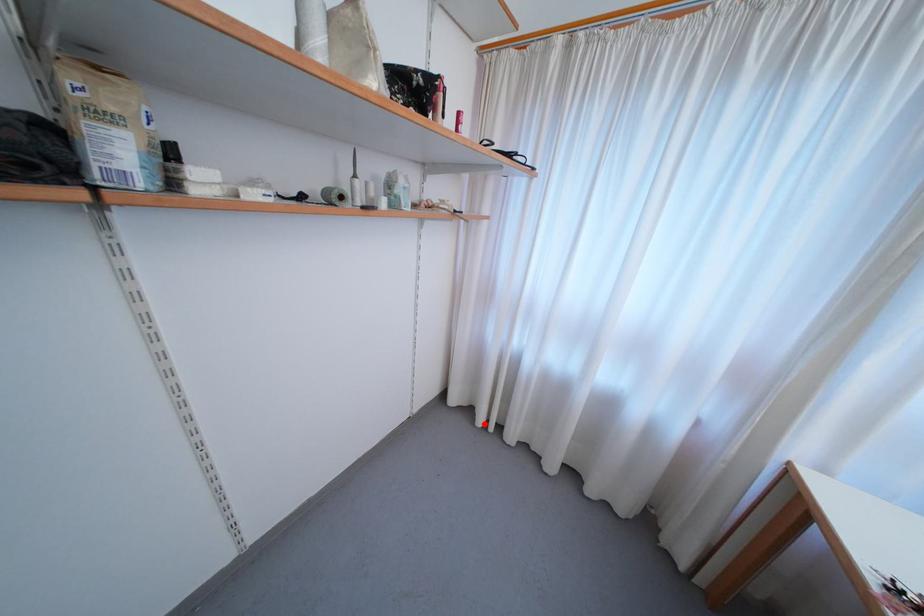
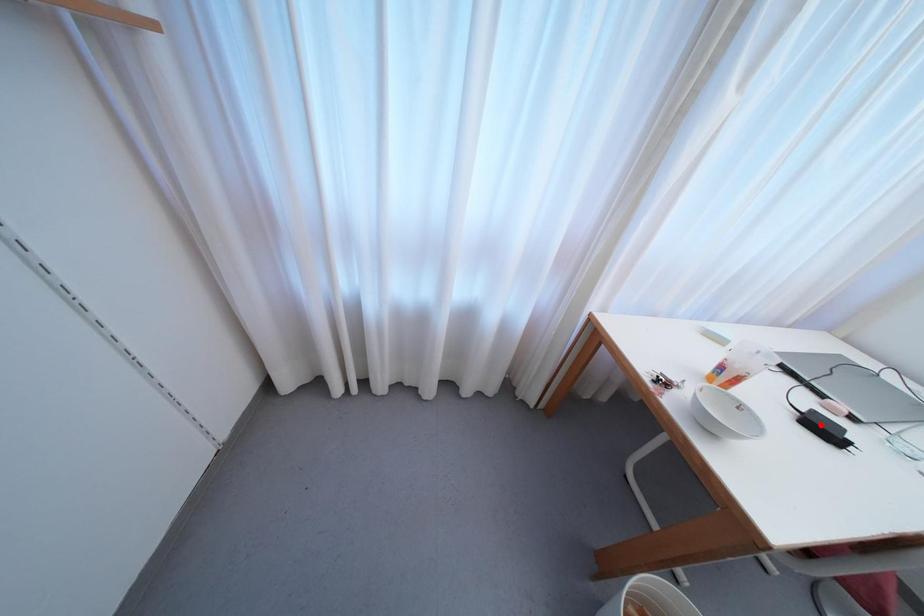
I am providing you with two images of the same scene from different viewpoints. A red point is marked on the first image and another point is marked on the second image. Is the red point in image1 aligned with the point shown in image2?

No